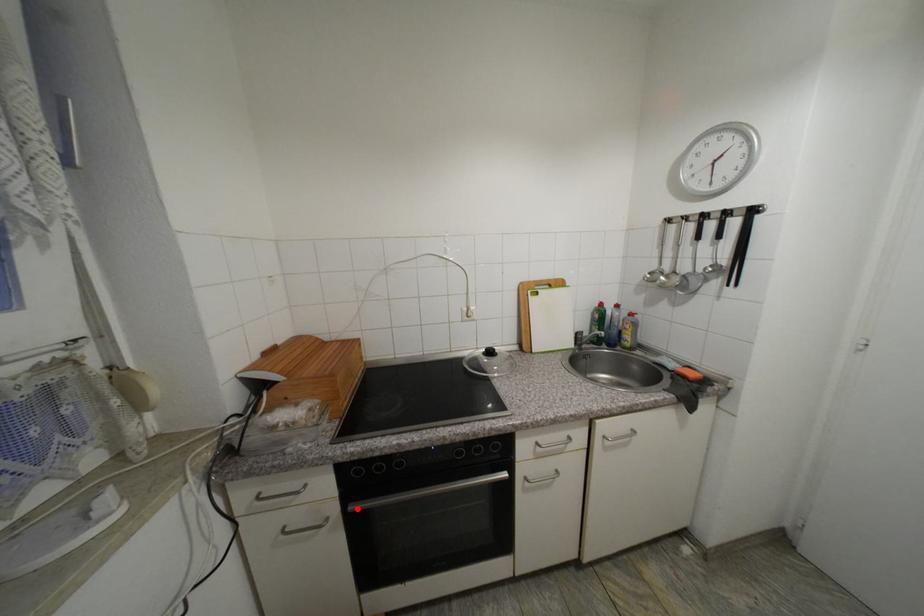
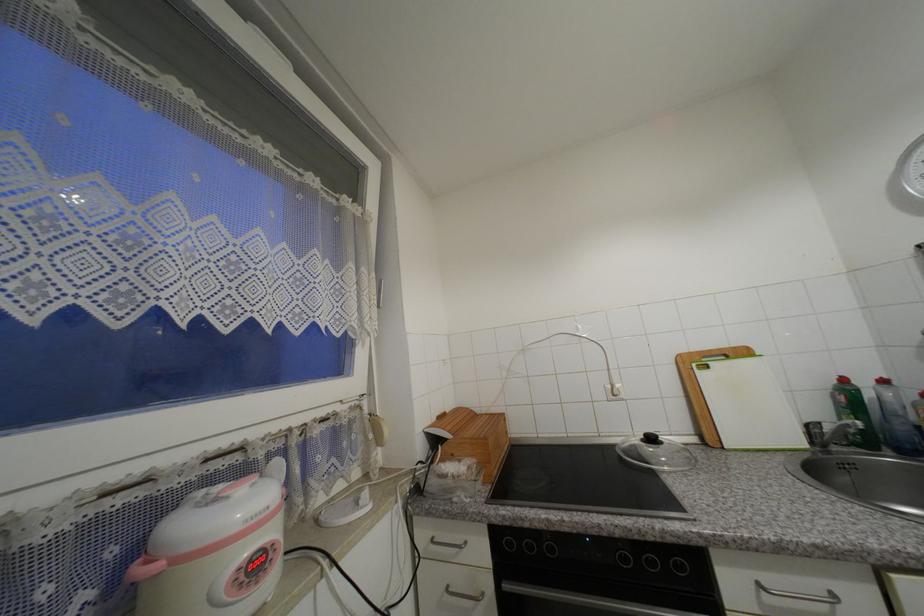
Question: I am providing you with two images of the same scene from different viewpoints. Image1 has a red point marked. In image2, the corresponding 3D location appears at what relative position? Reply with the corresponding letter.

Choices:
 (A) Closer
 (B) Farther

Answer: (A)